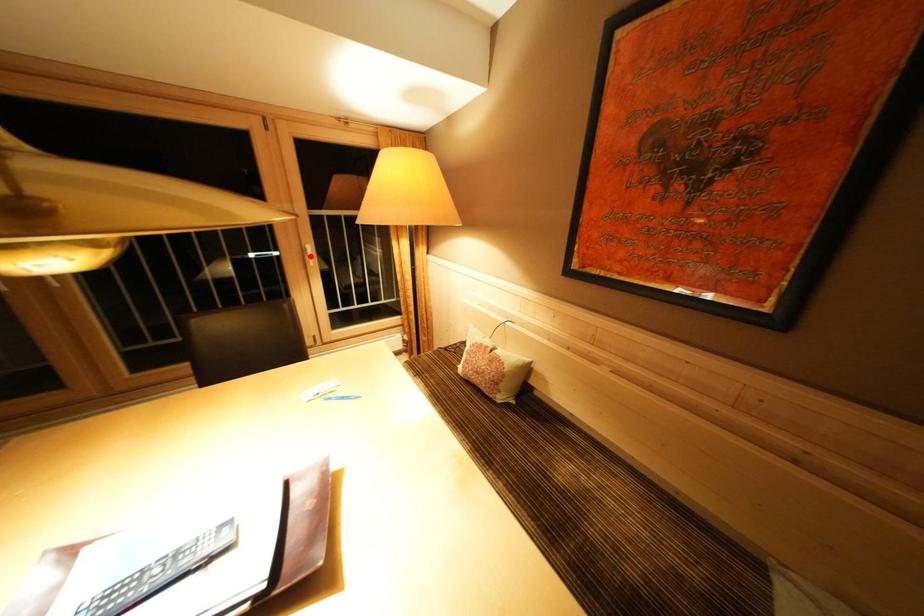
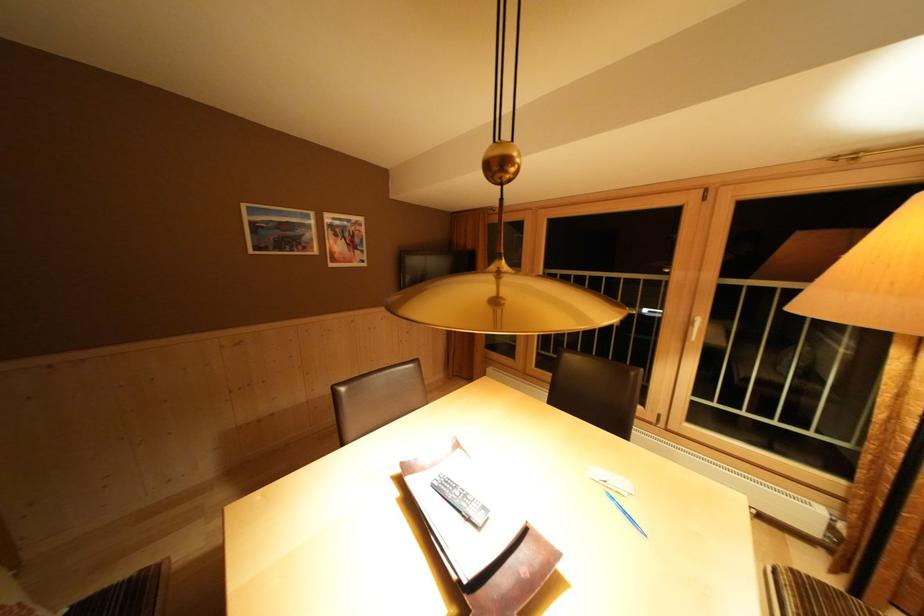
Question: I am providing you with two images of the same scene from different viewpoints. Image1 has a red point marked. In image2, the corresponding 3D location appears at what relative position? Reply with the corresponding letter.

Choices:
 (A) Closer
 (B) Farther

Answer: (B)